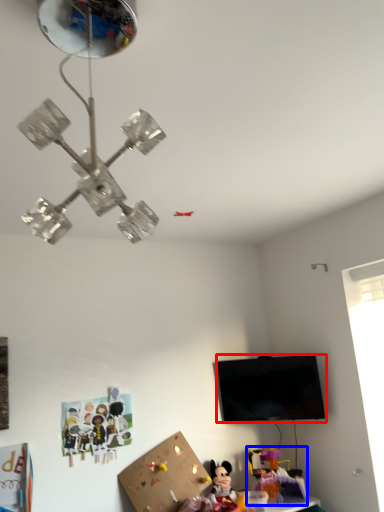
Question: Which point is closer to the camera, television (highlighted by a red box) or toy (highlighted by a blue box)?

Choices:
 (A) television
 (B) toy

Answer: (A)